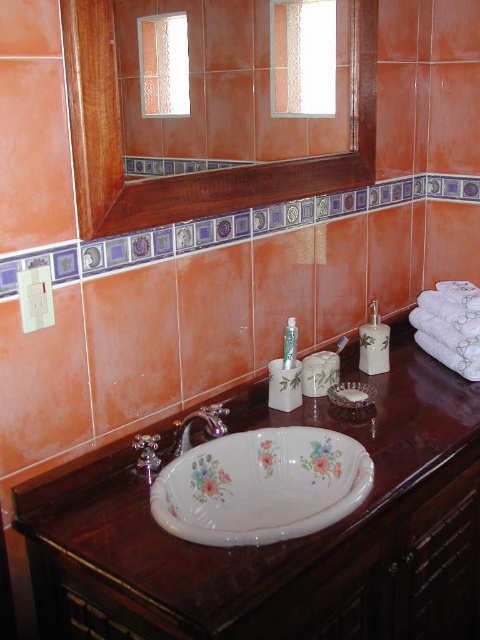
Question: Which point is closer to the camera?

Choices:
 (A) (126, 196)
 (B) (290, 321)

Answer: (A)

Question: From the image, what is the correct spatial relationship of brown polished wood counter top at center in relation to wooden mirror at upper center?

Choices:
 (A) left
 (B) right

Answer: (B)

Question: Can you confirm if white glossy soap dispenser at right is bigger than white glossy toothpaste tube at center?

Choices:
 (A) yes
 (B) no

Answer: (A)

Question: Observing the image, what is the correct spatial positioning of wooden mirror at upper center in reference to white glossy toothpaste tube at center?

Choices:
 (A) left
 (B) right

Answer: (A)

Question: Which point is farther to the camera?

Choices:
 (A) (x=280, y=189)
 (B) (x=360, y=356)
 (C) (x=40, y=496)

Answer: (B)

Question: Which object is closer to the camera taking this photo?

Choices:
 (A) wooden mirror at upper center
 (B) porcelain floral sink at center

Answer: (A)